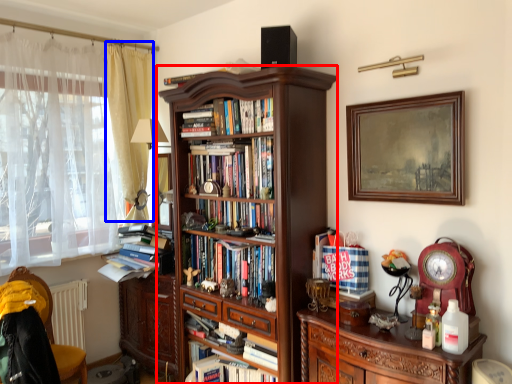
Question: Among these objects, which one is nearest to the camera, bookcase (highlighted by a red box) or curtain (highlighted by a blue box)?

Choices:
 (A) bookcase
 (B) curtain

Answer: (A)